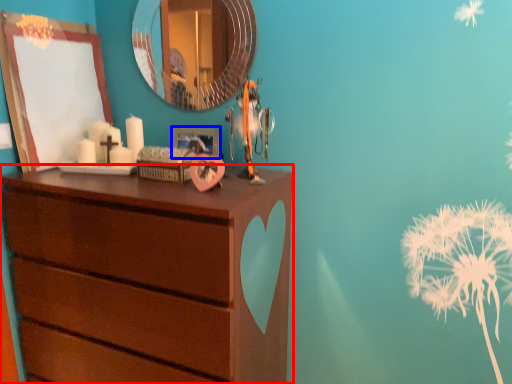
Question: Among these objects, which one is farthest to the camera, chest of drawers (highlighted by a red box) or picture frame (highlighted by a blue box)?

Choices:
 (A) chest of drawers
 (B) picture frame

Answer: (B)